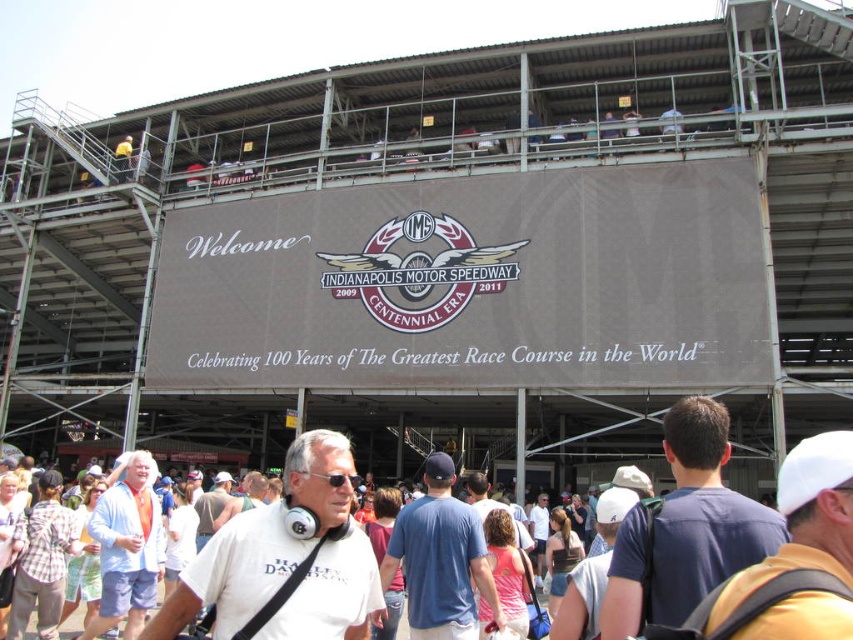
You are standing at the Indianapolis Motor Speedway and want to determine which of the two points, point [850,483] or point [360,477], is closer to you. Based on the scene description, which point is nearer?

Point [850,483] is closer to the viewer than point [360,477].

You are a photographer standing at the Indianapolis Motor Speedway and want to capture both the white matte baseball cap at upper right and the black matte sunglasses at center in a single frame. Considering their positions, is it possible to include both in your shot without moving your camera position?

The white matte baseball cap at upper right might be wider than black matte sunglasses at center, so it depends on the camera lens and framing. If the cap is wider, it could extend beyond the frame unless a wider angle is used. However, since their exact positions aren not specified beyond their general areas, it requires checking the actual layout.